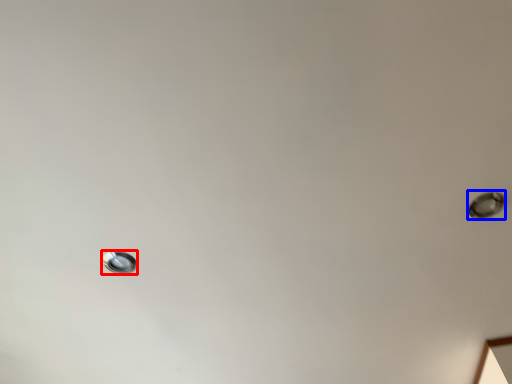
Question: Which of the following is the closest to the observer, droplight (highlighted by a red box) or droplight (highlighted by a blue box)?

Choices:
 (A) droplight
 (B) droplight

Answer: (B)